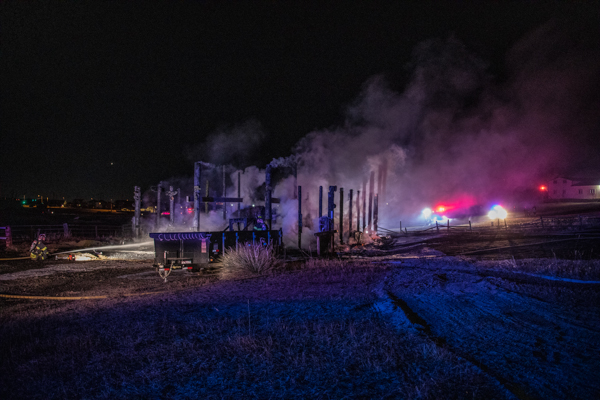
The image size is (600, 400). I want to click on glowing yellow light, so click(x=441, y=210), click(x=540, y=189).